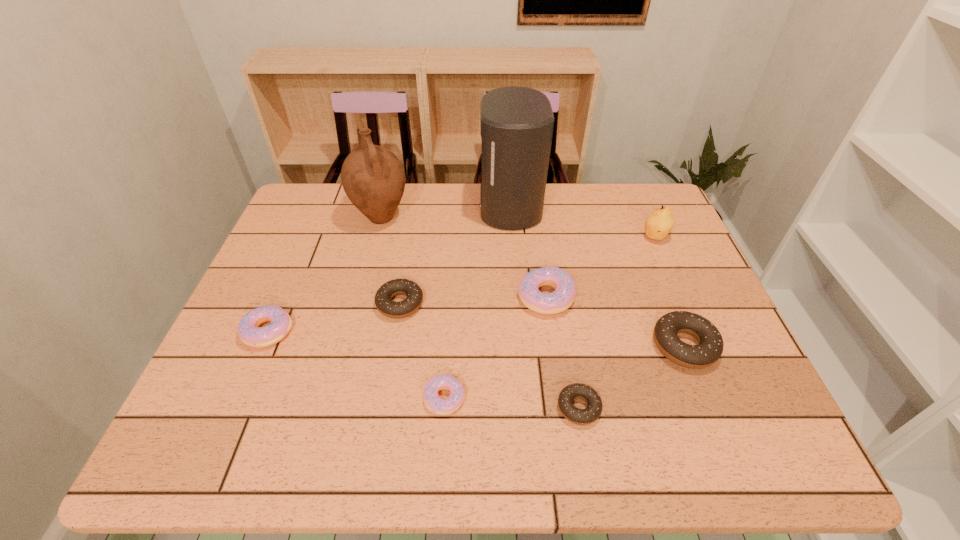
Identify the location of free spot between the rightmost brown doughnut and the nearest brown doughnut. (632, 376).

Locate an element on the screen. This screenshot has width=960, height=540. free spot between the second brown doughnut from left to right and the second smallest pink doughnut is located at coordinates (423, 369).

Where is `empty space between the second doughnut from left to right and the pear`? This screenshot has width=960, height=540. empty space between the second doughnut from left to right and the pear is located at coordinates (527, 270).

The image size is (960, 540). Identify the location of free space between the second smallest brown doughnut and the coffee maker. (455, 255).

The width and height of the screenshot is (960, 540). Identify the location of vacant space that's between the fifth doughnut from right to left and the second biggest pink doughnut. (334, 318).

Where is `free space between the leftmost brown doughnut and the coffee maker`? free space between the leftmost brown doughnut and the coffee maker is located at coordinates (455, 255).

Identify the location of free space that is in between the biggest brown doughnut and the second smallest brown doughnut. (542, 325).

This screenshot has width=960, height=540. Identify the location of free space that is in between the rightmost pink doughnut and the leftmost brown doughnut. (473, 300).

Find the location of a particular element. The image size is (960, 540). object that ranks as the eighth closest to the biggest pink doughnut is located at coordinates (250, 333).

You are a GUI agent. You are given a task and a screenshot of the screen. Output one action in this format:
    pyautogui.click(x=<x>, y=<y>)
    Task: Click on the object that can be found as the seventh closest to the dark coffee maker
    The height and width of the screenshot is (540, 960).
    Given the screenshot: What is the action you would take?
    pyautogui.click(x=591, y=413)